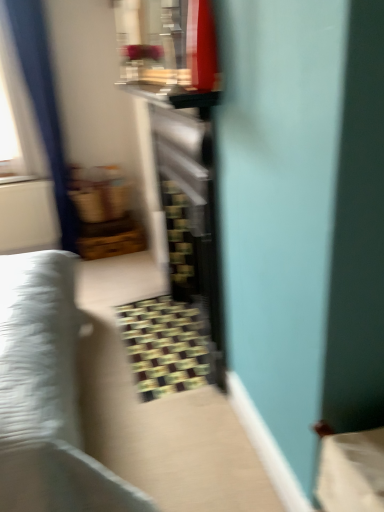
Locate an element on the screen. empty space that is ontop of woven fabric carpet at center (from a real-world perspective) is located at coordinates (165, 342).